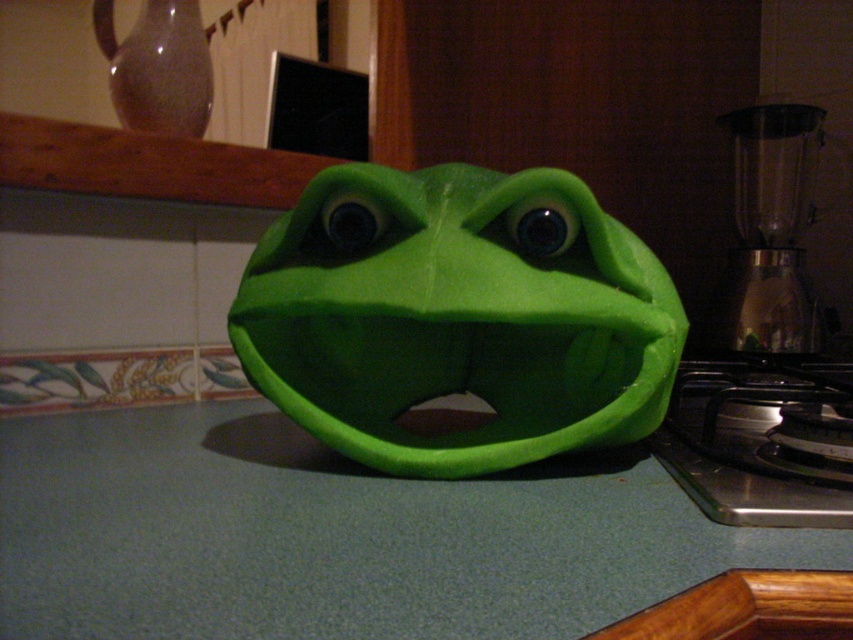
Question: Among these objects, which one is nearest to the camera?

Choices:
 (A) green matte mask at center
 (B) transparent glass blender at right
 (C) green matte counter top at center

Answer: (C)

Question: Which object is the closest to the green matte counter top at center?

Choices:
 (A) transparent glass blender at right
 (B) green matte mask at center

Answer: (B)

Question: Considering the relative positions of green matte mask at center and transparent glass blender at right in the image provided, where is green matte mask at center located with respect to transparent glass blender at right?

Choices:
 (A) right
 (B) left

Answer: (B)

Question: Observing the image, what is the correct spatial positioning of green matte mask at center in reference to transparent glass blender at right?

Choices:
 (A) right
 (B) left

Answer: (B)

Question: Does green matte counter top at center have a lesser width compared to transparent glass blender at right?

Choices:
 (A) no
 (B) yes

Answer: (A)

Question: Which of the following is the closest to the observer?

Choices:
 (A) transparent glass blender at right
 (B) green matte counter top at center

Answer: (B)